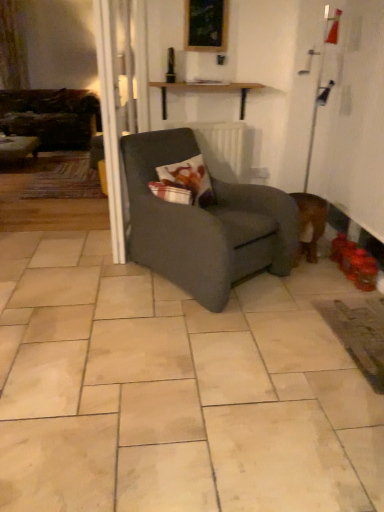
Locate an element on the screen. The width and height of the screenshot is (384, 512). white glossy screen door at left is located at coordinates (112, 124).

Find the location of a particular element. matte wooden table at left, which ranks as the first table in back-to-front order is located at coordinates (18, 149).

This screenshot has width=384, height=512. Find the location of `printed fabric pillow at center`. printed fabric pillow at center is located at coordinates (189, 179).

Find the location of a particular element. Image resolution: width=384 pixels, height=512 pixels. dark gray fabric chair at center is located at coordinates (204, 224).

Which object is further away from the camera, velvet dark brown couch at left or wooden picture frame at upper center?

velvet dark brown couch at left.

From a real-world perspective, is velvet dark brown couch at left positioned above or below wooden picture frame at upper center?

In terms of real-world spatial position, velvet dark brown couch at left is below wooden picture frame at upper center.

Does point (57, 132) come farther from viewer compared to point (189, 23)?

Yes, point (57, 132) is behind point (189, 23).

Can you confirm if velvet dark brown couch at left is positioned to the right of wooden picture frame at upper center?

Incorrect, velvet dark brown couch at left is not on the right side of wooden picture frame at upper center.

Is the depth of wooden picture frame at upper center greater than that of white textured radiator at center?

No, wooden picture frame at upper center is closer to the camera.

Locate an element on the screen. picture frame in front of the white textured radiator at center is located at coordinates (206, 25).

Is wooden picture frame at upper center shorter than white textured radiator at center?

Yes.

Which is more to the right, wooden picture frame at upper center or white textured radiator at center?

wooden picture frame at upper center is more to the right.

In terms of height, does matte wooden table at left, placed as the second table when sorted from front to back, look taller or shorter compared to printed fabric pillow at center?

Clearly, matte wooden table at left, placed as the second table when sorted from front to back, is shorter compared to printed fabric pillow at center.

Which is closer to the camera, (33, 148) or (193, 191)?

Point (33, 148) is farther from the camera than point (193, 191).

Is matte wooden table at left, placed as the second table when sorted from front to back, looking in the opposite direction of printed fabric pillow at center?

No.

Can you confirm if wooden picture frame at upper center is bigger than matte wooden table at left, acting as the second table starting from the right?

Actually, wooden picture frame at upper center might be smaller than matte wooden table at left, acting as the second table starting from the right.

Is point (211, 12) positioned after point (29, 143)?

No.

Is wooden picture frame at upper center thinner than matte wooden table at left, placed as the second table when sorted from front to back?

Yes.

From a real-world perspective, does printed fabric pillow at center stand above matte wooden table at left, which appears as the 1th table when viewed from the left?

Yes, from a real-world perspective, printed fabric pillow at center is over matte wooden table at left, which appears as the 1th table when viewed from the left

Is printed fabric pillow at center not close to matte wooden table at left, acting as the second table starting from the right?

Yes, printed fabric pillow at center and matte wooden table at left, acting as the second table starting from the right, are located far from each other.

Does printed fabric pillow at center have a lesser width compared to matte wooden table at left, which ranks as the first table in back-to-front order?

Yes, printed fabric pillow at center is thinner than matte wooden table at left, which ranks as the first table in back-to-front order.

Is wooden shelf at upper center, arranged as the 2th table when viewed from the back, not near white textured radiator at center?

wooden shelf at upper center, arranged as the 2th table when viewed from the back, is near white textured radiator at center, not far away.

Considering the sizes of objects wooden shelf at upper center, which is the first table from front to back, and white textured radiator at center in the image provided, who is smaller, wooden shelf at upper center, which is the first table from front to back, or white textured radiator at center?

Smaller between the two is white textured radiator at center.

Considering the relative sizes of wooden shelf at upper center, which is the 1th table in right-to-left order, and white textured radiator at center in the image provided, is wooden shelf at upper center, which is the 1th table in right-to-left order, shorter than white textured radiator at center?

Yes.

Based on the photo, would you say wooden shelf at upper center, placed as the second table when sorted from left to right, contains white textured radiator at center?

No.

From the image's perspective, between wooden shelf at upper center, which is the 1th table in right-to-left order, and printed fabric pillow at center, who is located below?

printed fabric pillow at center is shown below in the image.

What's the angular difference between wooden shelf at upper center, placed as the second table when sorted from left to right, and printed fabric pillow at center's facing directions?

36.6 degrees.

From a real-world perspective, which object rests below the other?

printed fabric pillow at center is physically lower.

Does point (150, 86) come behind point (211, 200)?

That is True.

You are a GUI agent. You are given a task and a screenshot of the screen. Output one action in this format:
    pyautogui.click(x=<x>, y=<y>)
    Task: Click on the studio couch behind the wooden picture frame at upper center
    
    Given the screenshot: What is the action you would take?
    point(51,117)

Locate an element on the screen. picture frame on the right of white textured radiator at center is located at coordinates (206, 25).

Which object lies further to the anchor point matte wooden table at left, which appears as the 1th table when viewed from the left, wooden picture frame at upper center or white textured radiator at center?

wooden picture frame at upper center.

Estimate the real-world distances between objects in this image. Which object is further from wooden shelf at upper center, arranged as the 2th table when viewed from the back, dark gray fabric chair at center or white textured radiator at center?

dark gray fabric chair at center.

Looking at the image, which one is located further to matte wooden table at left, which appears as the 1th table when viewed from the left, printed fabric pillow at center or wooden shelf at upper center, which is the first table from front to back?

The object further to matte wooden table at left, which appears as the 1th table when viewed from the left, is printed fabric pillow at center.

Considering their positions, is wooden shelf at upper center, arranged as the 2th table when viewed from the back, positioned closer to velvet dark brown couch at left than printed fabric pillow at center?

Among the two, wooden shelf at upper center, arranged as the 2th table when viewed from the back, is located nearer to velvet dark brown couch at left.

From the image, which object appears to be nearer to wooden picture frame at upper center, wooden shelf at upper center, which is the 1th table in right-to-left order, or white textured radiator at center?

wooden shelf at upper center, which is the 1th table in right-to-left order.

When comparing their distances from white textured radiator at center, does printed fabric pillow at center or velvet dark brown couch at left seem further?

velvet dark brown couch at left is further to white textured radiator at center.

Based on their spatial positions, is wooden shelf at upper center, placed as the second table when sorted from left to right, or printed fabric pillow at center closer to white glossy screen door at left?

printed fabric pillow at center.

Considering their positions, is wooden shelf at upper center, which is the 1th table in right-to-left order, positioned further to wooden picture frame at upper center than matte wooden table at left, placed as the second table when sorted from front to back?

matte wooden table at left, placed as the second table when sorted from front to back.

Where is `picture frame located between dark gray fabric chair at center and velvet dark brown couch at left in the depth direction`? Image resolution: width=384 pixels, height=512 pixels. picture frame located between dark gray fabric chair at center and velvet dark brown couch at left in the depth direction is located at coordinates (206, 25).

Locate an element on the screen. This screenshot has width=384, height=512. screen door between wooden picture frame at upper center and dark gray fabric chair at center in the vertical direction is located at coordinates (112, 124).

You are a GUI agent. You are given a task and a screenshot of the screen. Output one action in this format:
    pyautogui.click(x=<x>, y=<y>)
    Task: Click on the picture frame between dark gray fabric chair at center and matte wooden table at left, acting as the second table starting from the right, in the front-back direction
    
    Given the screenshot: What is the action you would take?
    pyautogui.click(x=206, y=25)

Where is `pillow between wooden picture frame at upper center and dark gray fabric chair at center from top to bottom`? The height and width of the screenshot is (512, 384). pillow between wooden picture frame at upper center and dark gray fabric chair at center from top to bottom is located at coordinates click(189, 179).